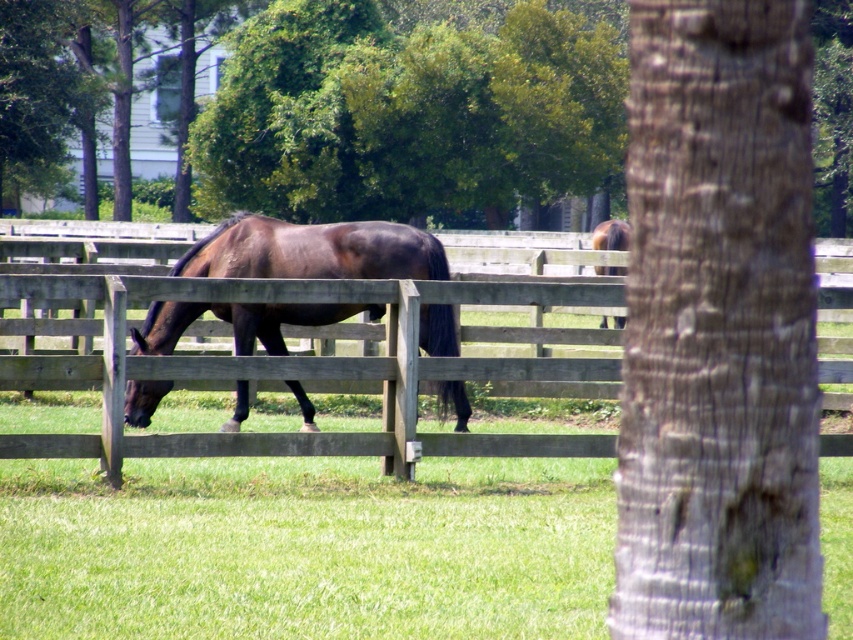
Is point (843, 193) more distant than point (196, 365)?

Yes, it is.

Who is more distant from viewer, (294, 60) or (572, 436)?

The point (294, 60) is behind.

Where is `green leafy tree at upper center`? Image resolution: width=853 pixels, height=640 pixels. green leafy tree at upper center is located at coordinates (408, 113).

Does wooden fence at center have a larger size compared to shiny brown horse at center?

No.

Is point (283, 433) farther from viewer compared to point (151, 337)?

That is False.

Who is more forward, [554,332] or [436,353]?

Point [436,353] is in front.

Locate an element on the screen. The width and height of the screenshot is (853, 640). wooden fence at center is located at coordinates (310, 365).

Who is lower down, gray textured bark at center right or green leafy tree at upper center?

gray textured bark at center right

Is gray textured bark at center right thinner than green leafy tree at upper center?

Indeed, gray textured bark at center right has a lesser width compared to green leafy tree at upper center.

Is point (717, 552) positioned behind point (572, 102)?

No.

You are a GUI agent. You are given a task and a screenshot of the screen. Output one action in this format:
    pyautogui.click(x=<x>, y=<y>)
    Task: Click on the gray textured bark at center right
    Image resolution: width=853 pixels, height=640 pixels.
    Given the screenshot: What is the action you would take?
    pyautogui.click(x=718, y=328)